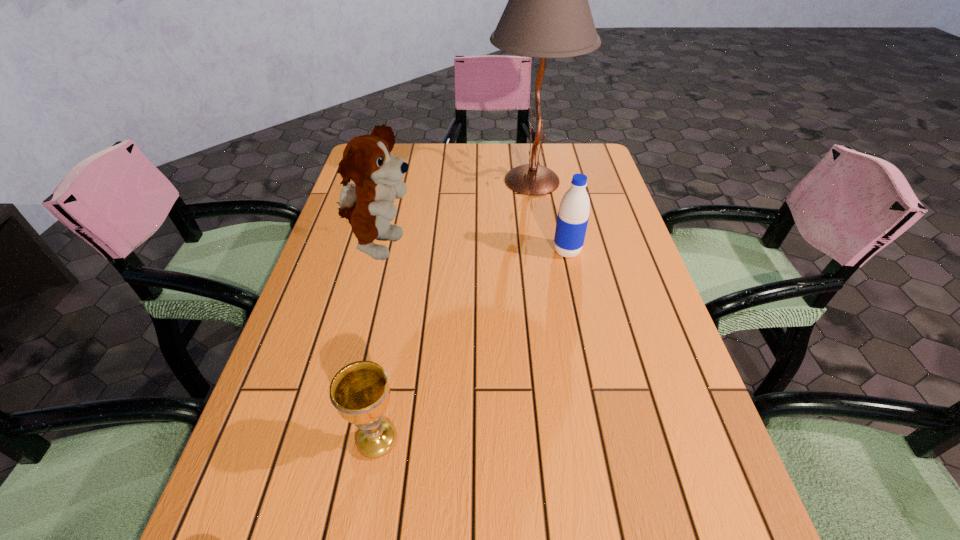
Where is `object that is the closest to the chalice`? object that is the closest to the chalice is located at coordinates (367, 203).

Where is `vacant region that satisfies the following two spatial constraints: 1. on the face of the water bottle; 2. on the left side of the puppy`? The image size is (960, 540). vacant region that satisfies the following two spatial constraints: 1. on the face of the water bottle; 2. on the left side of the puppy is located at coordinates (379, 251).

Find the location of a particular element. vacant area in the image that satisfies the following two spatial constraints: 1. on the back side of the nearest object; 2. on the left side of the second shortest object is located at coordinates (410, 251).

Locate an element on the screen. vacant area in the image that satisfies the following two spatial constraints: 1. on the front-facing side of the tallest object; 2. on the front side of the nearest object is located at coordinates (573, 440).

Find the location of `free space that satisfies the following two spatial constraints: 1. on the front-facing side of the farthest object; 2. on the left side of the water bottle`. free space that satisfies the following two spatial constraints: 1. on the front-facing side of the farthest object; 2. on the left side of the water bottle is located at coordinates (543, 251).

Find the location of a particular element. The height and width of the screenshot is (540, 960). vacant position in the image that satisfies the following two spatial constraints: 1. on the front-facing side of the farthest object; 2. on the right side of the water bottle is located at coordinates (543, 251).

Where is `vacant space that satisfies the following two spatial constraints: 1. on the front-facing side of the tallest object; 2. on the right side of the second shortest object`? vacant space that satisfies the following two spatial constraints: 1. on the front-facing side of the tallest object; 2. on the right side of the second shortest object is located at coordinates (543, 251).

This screenshot has width=960, height=540. In order to click on vacant region that satisfies the following two spatial constraints: 1. on the face of the second tallest object; 2. on the back side of the chalice in this screenshot , I will do `click(331, 440)`.

The image size is (960, 540). Find the location of `vacant area in the image that satisfies the following two spatial constraints: 1. on the back side of the second shortest object; 2. on the front-facing side of the tallest object`. vacant area in the image that satisfies the following two spatial constraints: 1. on the back side of the second shortest object; 2. on the front-facing side of the tallest object is located at coordinates (552, 180).